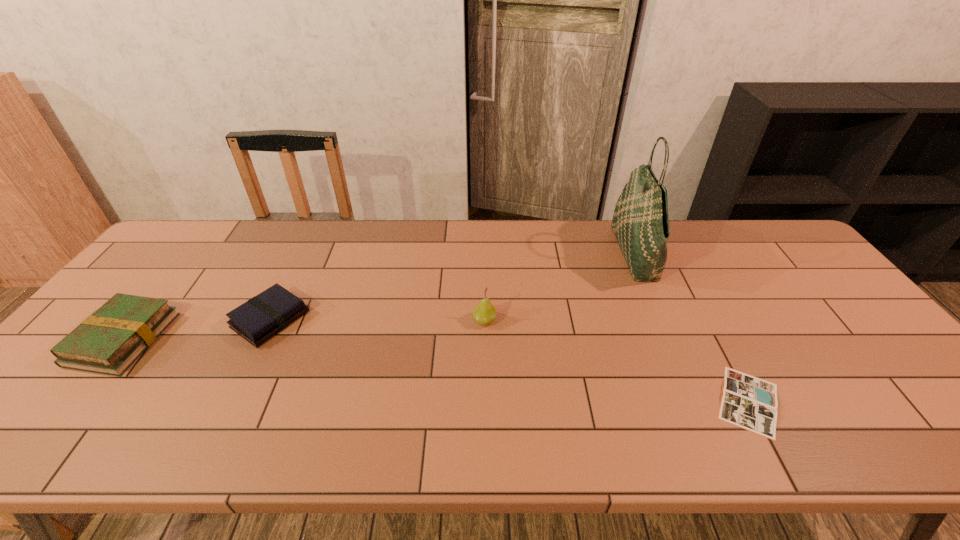
In the image, there is a desktop. At what (x,y) coordinates should I click in order to perform the action: click on free space at the left edge. Please return your answer as a coordinate pair (x, y). This screenshot has height=540, width=960. Looking at the image, I should click on (47, 392).

The image size is (960, 540). In the image, there is a desktop. Identify the location of free space at the far left corner. (169, 261).

What are the coordinates of `vacant region between the tote bag and the leftmost object` in the screenshot? It's located at (379, 296).

Locate an element on the screen. This screenshot has height=540, width=960. free space between the leftmost book and the fourth tallest object is located at coordinates (197, 329).

Identify the location of free point between the tallest object and the shortest book. This screenshot has height=540, width=960. (691, 327).

You are a GUI agent. You are given a task and a screenshot of the screen. Output one action in this format:
    pyautogui.click(x=<x>, y=<y>)
    Task: Click on the free area in between the rightmost book and the second tallest object
    
    Given the screenshot: What is the action you would take?
    pyautogui.click(x=616, y=361)

At what (x,y) coordinates should I click in order to perform the action: click on free point between the shortest book and the third object from right to left. Please return your answer as a coordinate pair (x, y). The image size is (960, 540). Looking at the image, I should click on (616, 361).

I want to click on empty location between the third shortest object and the pear, so click(303, 329).

The image size is (960, 540). Identify the location of free spot between the third tallest object and the rightmost book. 436,370.

Where is `free space that is in between the shortest book and the third object from left to right`? This screenshot has width=960, height=540. free space that is in between the shortest book and the third object from left to right is located at coordinates (616, 361).